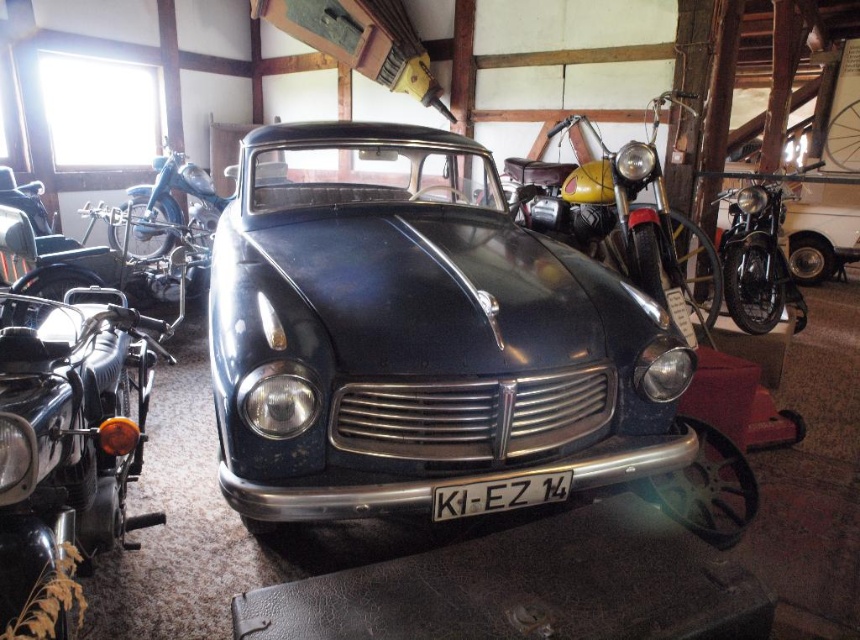
Question: Which object appears closest to the camera in this image?

Choices:
 (A) shiny chrome motorcycle at right
 (B) yellow matte motorcycle at center
 (C) shiny black motorcycle at left

Answer: (C)

Question: Which of the following is the closest to the observer?

Choices:
 (A) (723, 252)
 (B) (446, 269)
 (C) (611, 241)

Answer: (B)

Question: Which object is the farthest from the glossy dark blue car at center?

Choices:
 (A) white plastic license plate at center
 (B) shiny black motorcycle at left
 (C) yellow matte motorcycle at center

Answer: (C)

Question: Can you confirm if glossy dark blue car at center is positioned below yellow matte motorcycle at center?

Choices:
 (A) no
 (B) yes

Answer: (B)

Question: Is shiny black motorcycle at left to the right of yellow matte motorcycle at center from the viewer's perspective?

Choices:
 (A) no
 (B) yes

Answer: (A)

Question: Considering the relative positions of glossy dark blue car at center and white plastic license plate at center in the image provided, where is glossy dark blue car at center located with respect to white plastic license plate at center?

Choices:
 (A) above
 (B) below

Answer: (A)